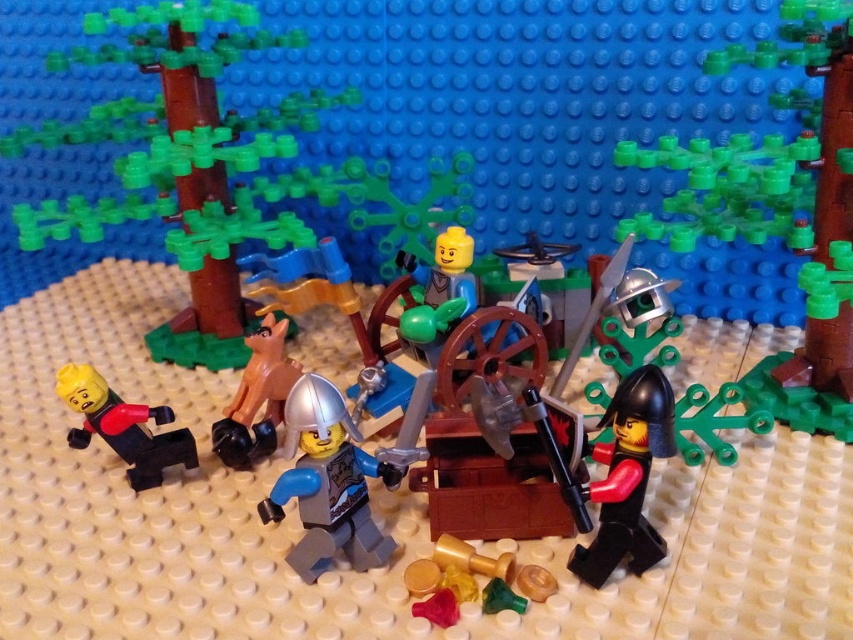
From the picture: You are a Lego minifigure trying to cross the beige baseplate. There is a brown matte animal at center and a shiny silver sword at center right in your path. Which object has a larger width that might block your path?

The brown matte animal at center has a larger width than the shiny silver sword at center right, so it might block your path more significantly.

In the Lego diorama, there is a brown wood tree at left and a shiny silver sword at center right. Which object takes up more space in the scene?

The brown wood tree at left is bigger than the shiny silver sword at center right, so it takes up more space in the scene.